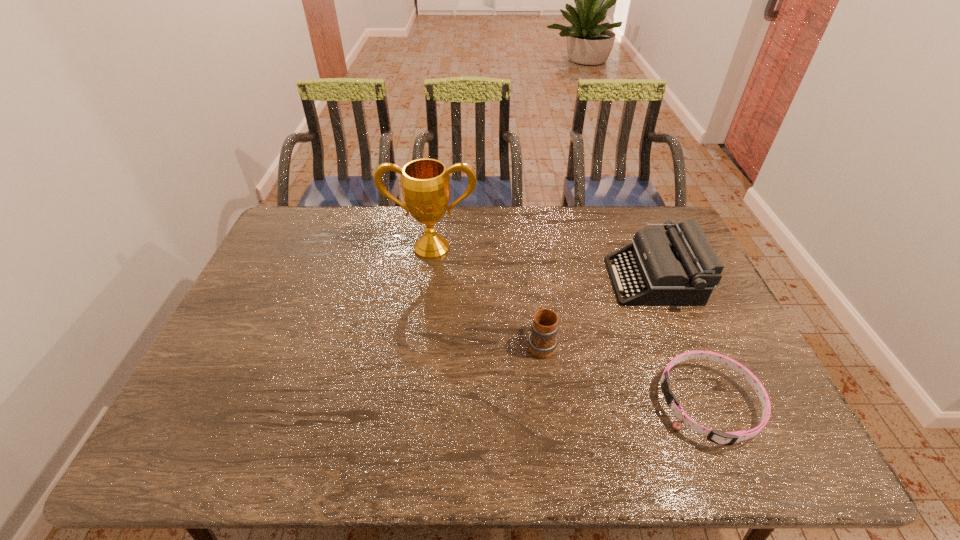
Where is `blank space located 0.370m on the typing side of the typewriter`? blank space located 0.370m on the typing side of the typewriter is located at coordinates (494, 280).

Where is `free space located on the side of the mug with the handle`? This screenshot has height=540, width=960. free space located on the side of the mug with the handle is located at coordinates (532, 272).

Identify the location of free point located on the side of the mug with the handle. This screenshot has height=540, width=960. click(528, 241).

Find the location of a particular element. This screenshot has width=960, height=540. blank space located on the side of the mug with the handle is located at coordinates (530, 258).

This screenshot has width=960, height=540. I want to click on vacant space located 0.330m with the buckle on the nearest object, so click(x=526, y=404).

In order to click on free space located with the buckle on the nearest object in this screenshot , I will do `click(612, 404)`.

Identify the location of free region located with the buckle on the nearest object. The width and height of the screenshot is (960, 540). (624, 404).

The height and width of the screenshot is (540, 960). I want to click on object that is positioned at the far edge, so click(425, 183).

Locate an element on the screen. object present at the near edge is located at coordinates (728, 438).

Where is `typewriter that is at the right edge`? The image size is (960, 540). typewriter that is at the right edge is located at coordinates (679, 267).